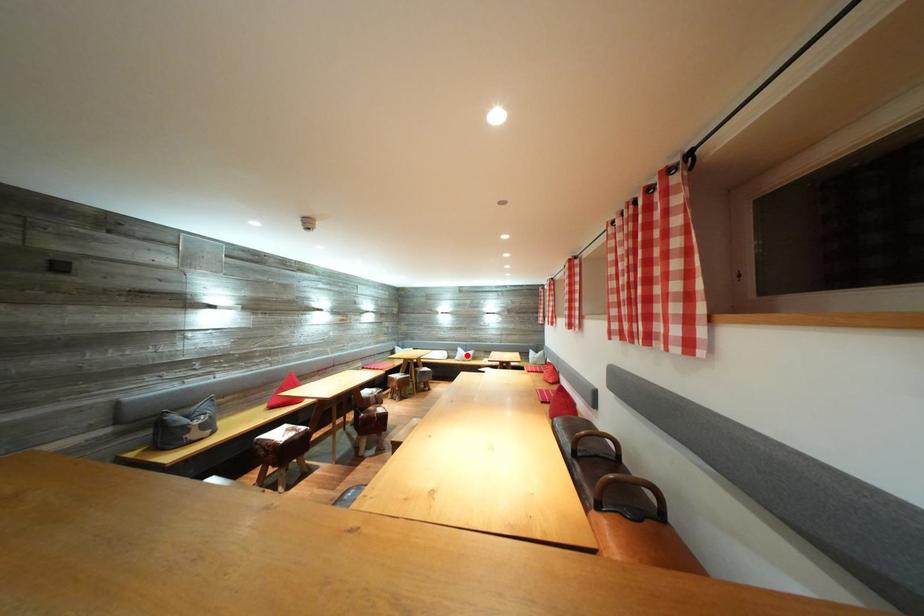
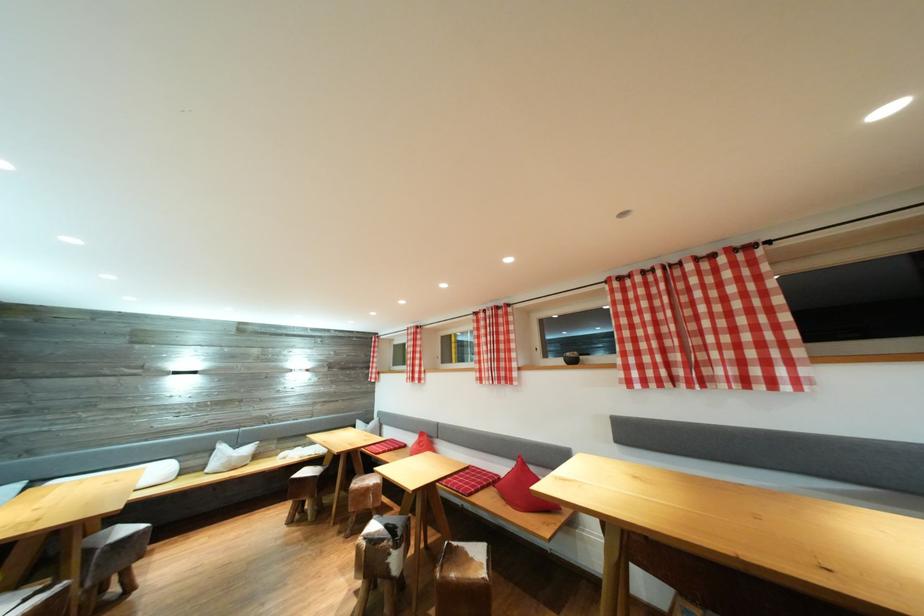
Where in the second image is the point corresponding to the highlighted location from the first image?

(228, 453)